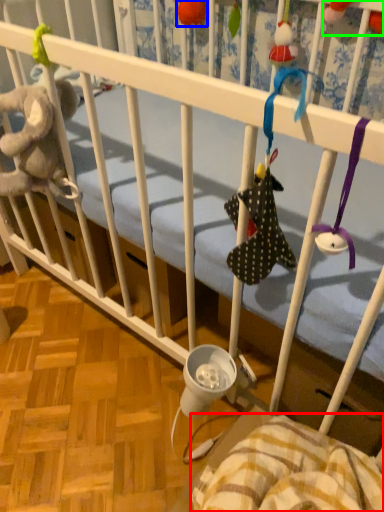
Question: Which object is positioned closest to blanket (highlighted by a red box)? Select from toy (highlighted by a blue box) and toy (highlighted by a green box).

Choices:
 (A) toy
 (B) toy

Answer: (B)